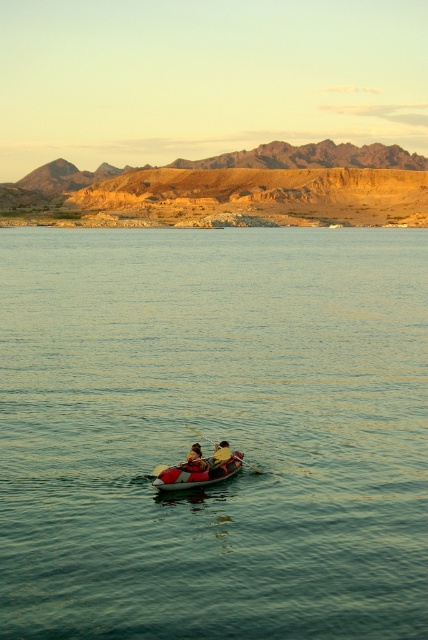
Question: Is the position of greenish-blue water at center less distant than that of smooth tan kayak at center?

Choices:
 (A) no
 (B) yes

Answer: (B)

Question: Does red rubber canoe at center appear under smooth tan kayak at center?

Choices:
 (A) no
 (B) yes

Answer: (B)

Question: Which object appears closest to the camera in this image?

Choices:
 (A) red rubber canoe at center
 (B) wooden paddle at center
 (C) smooth tan kayak at center
 (D) greenish-blue water at center

Answer: (D)

Question: Among these points, which one is farthest from the camera?

Choices:
 (A) (187, 465)
 (B) (252, 468)
 (C) (211, 465)
 (D) (178, 355)

Answer: (D)

Question: Among these points, which one is nearest to the camera?

Choices:
 (A) (169, 278)
 (B) (199, 452)
 (C) (196, 432)
 (D) (187, 488)

Answer: (D)

Question: Does red rubber canoe at center lie behind yellow rubber kayak at center?

Choices:
 (A) yes
 (B) no

Answer: (B)